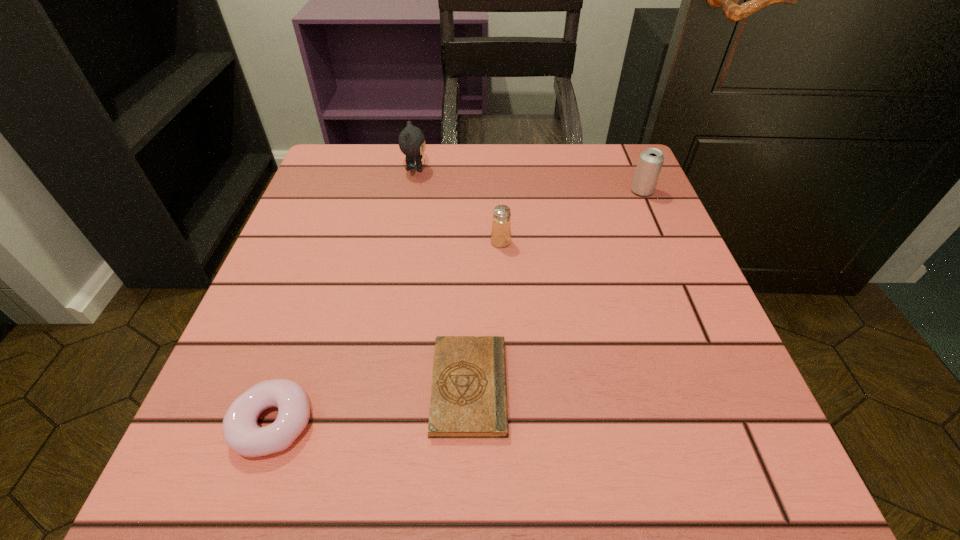
Locate an element on the screen. The width and height of the screenshot is (960, 540). vacant region located on the front of the rightmost object is located at coordinates (704, 334).

Where is `free space located on the back of the third farthest object`? free space located on the back of the third farthest object is located at coordinates (499, 213).

Where is `free space located on the back of the fourth tallest object`? The height and width of the screenshot is (540, 960). free space located on the back of the fourth tallest object is located at coordinates (308, 321).

The image size is (960, 540). Find the location of `blank space located 0.050m on the spine side of the shortest object`. blank space located 0.050m on the spine side of the shortest object is located at coordinates (541, 387).

I want to click on kitten present at the far edge, so click(411, 140).

You are a GUI agent. You are given a task and a screenshot of the screen. Output one action in this format:
    pyautogui.click(x=<x>, y=<y>)
    Task: Click on the beer can positioned at the far edge
    Image resolution: width=960 pixels, height=540 pixels.
    Given the screenshot: What is the action you would take?
    pyautogui.click(x=650, y=162)

Image resolution: width=960 pixels, height=540 pixels. Identify the location of doughnut located in the near edge section of the desktop. (241, 432).

At what (x,y) coordinates should I click in order to perform the action: click on diary located in the near edge section of the desktop. Please return your answer as a coordinate pair (x, y). This screenshot has height=540, width=960. Looking at the image, I should click on (468, 399).

Where is `object situated at the left edge`? object situated at the left edge is located at coordinates (241, 432).

Image resolution: width=960 pixels, height=540 pixels. What are the coordinates of `object that is at the right edge` in the screenshot? It's located at (650, 162).